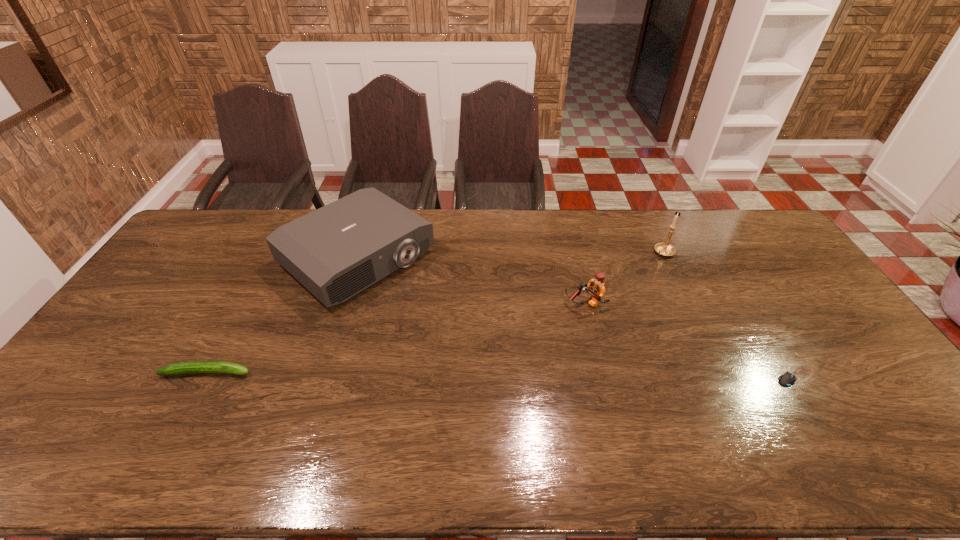
This screenshot has width=960, height=540. I want to click on vacant space located 0.240m on the handle side of the fourth object from left to right, so click(623, 294).

I want to click on vacant region located 0.080m on the handle side of the fourth object from left to right, so click(x=648, y=269).

Where is `free location located 0.250m on the front-facing side of the projector`? free location located 0.250m on the front-facing side of the projector is located at coordinates (462, 340).

The height and width of the screenshot is (540, 960). I want to click on vacant space located 0.130m on the front-facing side of the projector, so click(434, 318).

You are a GUI agent. You are given a task and a screenshot of the screen. Output one action in this format:
    pyautogui.click(x=<x>, y=<y>)
    Task: Click on the blank space located on the front-facing side of the projector
    This screenshot has height=540, width=960.
    Given the screenshot: What is the action you would take?
    pyautogui.click(x=457, y=336)

What are the coordinates of `free space located holding a crossbow in the hands of the Lego` in the screenshot? It's located at (547, 322).

Identify the location of free space located holding a crossbow in the hands of the Lego. (476, 364).

Locate an element on the screen. vacant area located holding a crossbow in the hands of the Lego is located at coordinates (476, 364).

At what (x,y) coordinates should I click in order to perform the action: click on candle holder at the far edge. Please return your answer as a coordinate pair (x, y). Looking at the image, I should click on pyautogui.click(x=665, y=249).

You are a GUI agent. You are given a task and a screenshot of the screen. Output one action in this format:
    pyautogui.click(x=<x>, y=<y>)
    Task: Click on the projector that is at the far edge
    
    Given the screenshot: What is the action you would take?
    pyautogui.click(x=335, y=252)